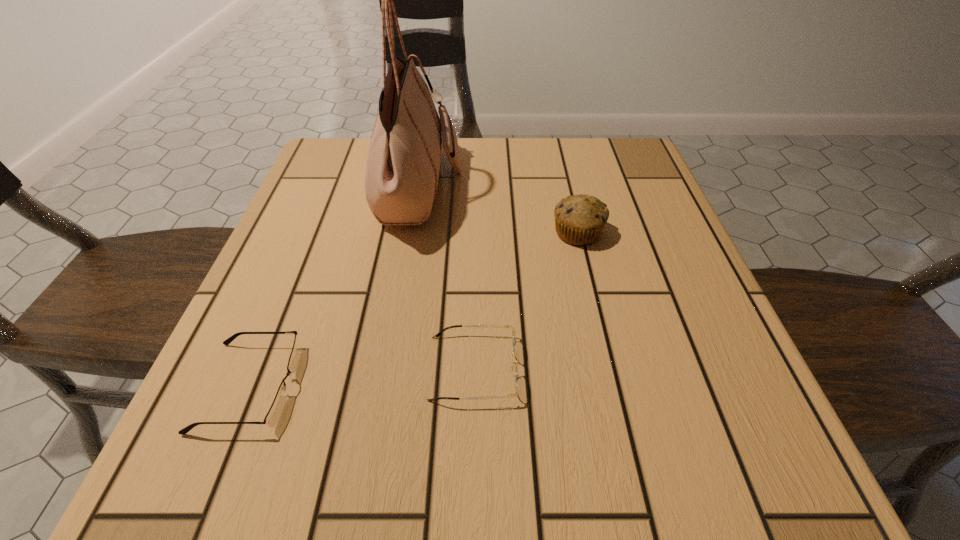
Identify the location of object positioned at the near edge. The width and height of the screenshot is (960, 540). (271, 419).

Identify the location of object present at the left edge. The width and height of the screenshot is (960, 540). (271, 419).

The image size is (960, 540). In order to click on object that is at the right edge in this screenshot , I will do `click(579, 219)`.

Locate an element on the screen. Image resolution: width=960 pixels, height=540 pixels. object present at the near left corner is located at coordinates (271, 419).

Image resolution: width=960 pixels, height=540 pixels. I want to click on free region at the far edge of the desktop, so click(x=522, y=186).

The width and height of the screenshot is (960, 540). What are the coordinates of `blank space at the near edge` in the screenshot? It's located at (305, 446).

The width and height of the screenshot is (960, 540). Identify the location of vacant space at the left edge. pyautogui.click(x=274, y=323).

Where is `vacant region at the right edge of the desktop`? The width and height of the screenshot is (960, 540). vacant region at the right edge of the desktop is located at coordinates (673, 219).

Locate an element on the screen. Image resolution: width=960 pixels, height=540 pixels. vacant region at the far left corner of the desktop is located at coordinates (332, 168).

The height and width of the screenshot is (540, 960). In the image, there is a desktop. In order to click on free space at the far right corner in this screenshot , I will do `click(644, 161)`.